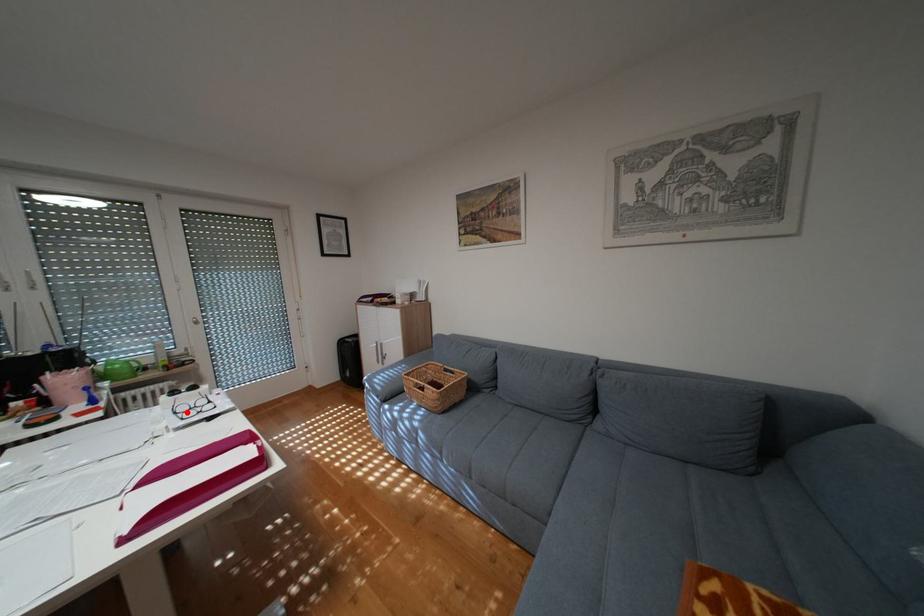
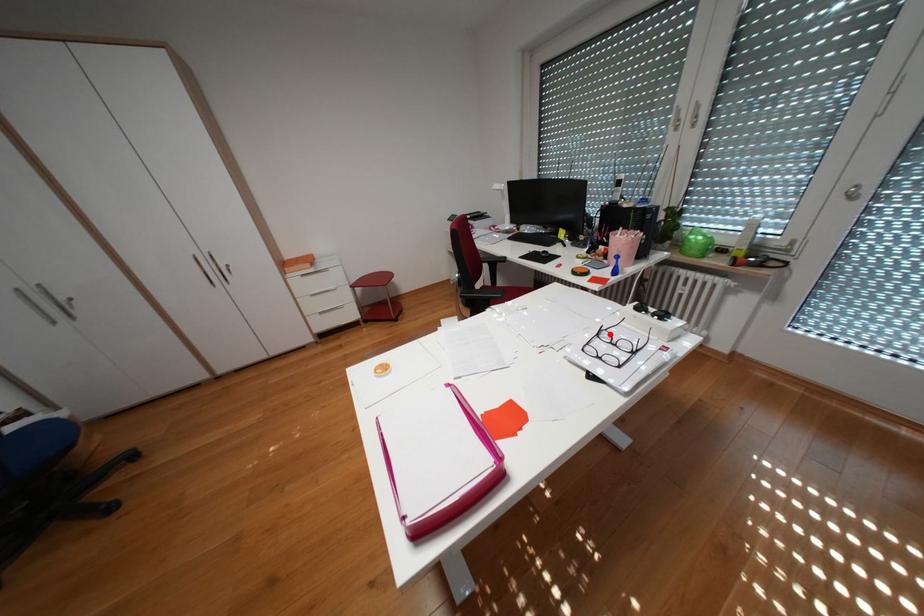
I am providing you with two images of the same scene from different viewpoints. A red point is marked on the first image and another point is marked on the second image. Are the points marked in image1 and image2 representing the same 3D position?

Yes